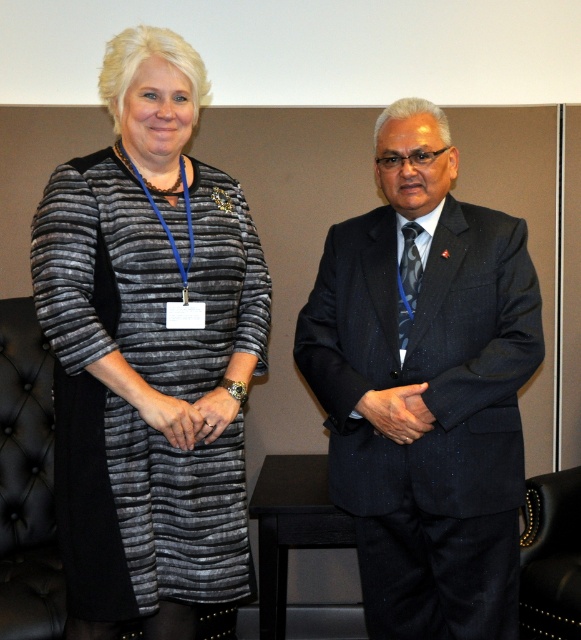
You are a photographer positioned in front of the striped fabric dress at center. You need to capture a full body shot of the person wearing it. Considering the recommended distance for such shots is 1.5 meters, is your current position suitable?

The distance between you and the striped fabric dress at center is 1.56 meters, which is slightly more than the recommended 1.5 meters. To capture a full body shot, you should move closer by approximately 6 centimeters to achieve the optimal distance.

From the picture: You are an event organizer and need to place a name tag holder at the center of the image. The striped fabric dress at center is currently at coordinates point 0.552, 0.258. Will placing the name tag holder at the exact center of the image interfere with the dress?

The striped fabric dress at center is located at point (149, 353), which is close to but not exactly the center of the image. Placing the name tag holder at the exact center may not interfere directly, but depends on the holder size and dress position.

You are a photographer setting up for a group photo. You notice the dark blue textured suit at right and the tufted leather armchair at lower left. Which object is covering the other in the image?

The dark blue textured suit at right is positioned over the tufted leather armchair at lower left, so the dark blue textured suit at right is covering the tufted leather armchair at lower left.